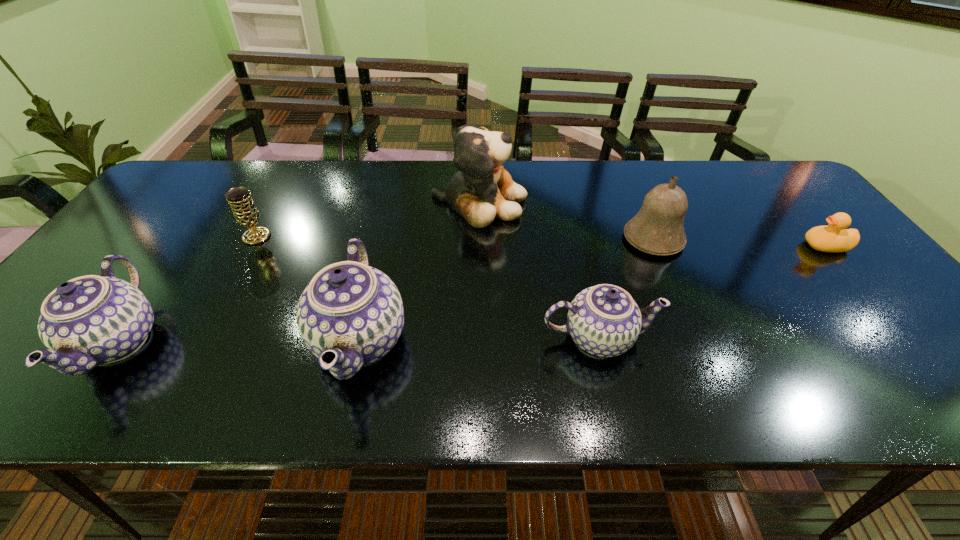
The image size is (960, 540). Identify the location of object that is at the left edge. (87, 321).

Locate an element on the screen. object that is at the right edge is located at coordinates (x=834, y=238).

Identify the location of object present at the near left corner. (87, 321).

Locate an element on the screen. blank space at the far edge is located at coordinates (275, 170).

Locate an element on the screen. The height and width of the screenshot is (540, 960). vacant space at the near edge is located at coordinates (717, 332).

This screenshot has width=960, height=540. I want to click on vacant region at the far right corner of the desktop, so click(x=784, y=195).

This screenshot has width=960, height=540. What are the coordinates of `empty location between the leftmost chinaware and the shortest object` in the screenshot? It's located at (472, 294).

Where is `empty location between the bell and the shortest chinaware`? This screenshot has height=540, width=960. empty location between the bell and the shortest chinaware is located at coordinates (626, 289).

Where is `free space between the sixth object from left to right and the duck`? free space between the sixth object from left to right and the duck is located at coordinates (739, 242).

You are a GUI agent. You are given a task and a screenshot of the screen. Output one action in this format:
    pyautogui.click(x=<x>, y=<y>)
    Task: Click on the vacant space in between the puppy and the chalice
    Image resolution: width=960 pixels, height=540 pixels.
    Given the screenshot: What is the action you would take?
    pyautogui.click(x=368, y=219)